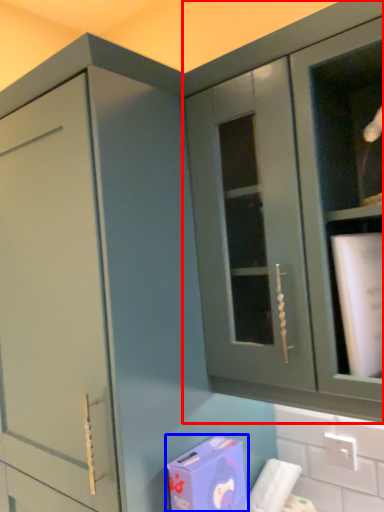
Question: Which point is closer to the camera, cabinetry (highlighted by a red box) or cardboard box (highlighted by a blue box)?

Choices:
 (A) cabinetry
 (B) cardboard box

Answer: (A)